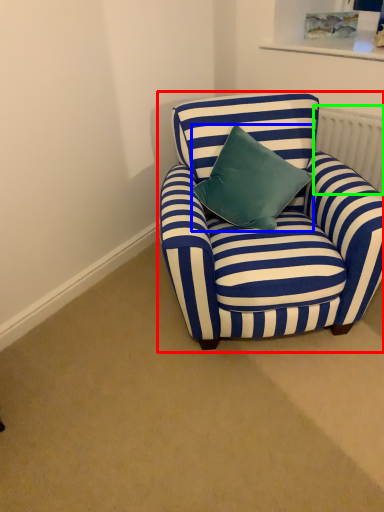
Question: Estimate the real-world distances between objects in this image. Which object is closer to chair (highlighted by a red box), pillow (highlighted by a blue box) or radiator (highlighted by a green box)?

Choices:
 (A) pillow
 (B) radiator

Answer: (A)